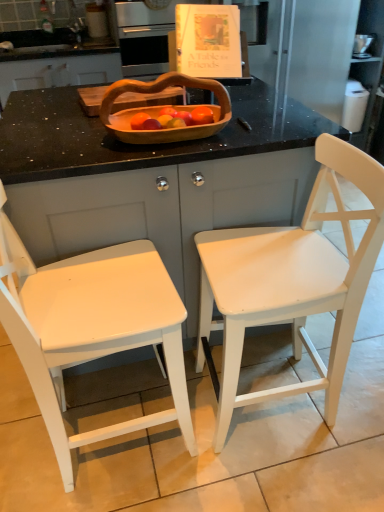
Question: Considering the relative sizes of wooden cutting board at upper center and matte white book at upper center in the image provided, is wooden cutting board at upper center bigger than matte white book at upper center?

Choices:
 (A) no
 (B) yes

Answer: (A)

Question: Can you confirm if wooden cutting board at upper center is wider than matte white book at upper center?

Choices:
 (A) yes
 (B) no

Answer: (B)

Question: Does wooden cutting board at upper center have a smaller size compared to matte white book at upper center?

Choices:
 (A) no
 (B) yes

Answer: (B)

Question: Is wooden cutting board at upper center turned away from matte white book at upper center?

Choices:
 (A) yes
 (B) no

Answer: (A)

Question: From the image's perspective, is wooden cutting board at upper center on matte white book at upper center?

Choices:
 (A) no
 (B) yes

Answer: (A)

Question: Considering the positions of matte wood counter at center and matte white book at upper center in the image, is matte wood counter at center wider or thinner than matte white book at upper center?

Choices:
 (A) wide
 (B) thin

Answer: (A)

Question: Relative to matte white book at upper center, is matte wood counter at center in front or behind?

Choices:
 (A) front
 (B) behind

Answer: (A)

Question: Is point (185, 233) positioned closer to the camera than point (119, 46)?

Choices:
 (A) closer
 (B) farther

Answer: (A)

Question: From a real-world perspective, is matte wood counter at center positioned above or below matte white book at upper center?

Choices:
 (A) below
 (B) above

Answer: (A)

Question: From a real-world perspective, is wooden cutting board at upper center positioned above or below white painted wood chair at left, which is the first chair in left-to-right order?

Choices:
 (A) below
 (B) above

Answer: (B)

Question: In terms of height, does wooden cutting board at upper center look taller or shorter compared to white painted wood chair at left, which is the first chair in left-to-right order?

Choices:
 (A) tall
 (B) short

Answer: (B)

Question: Considering the positions of wooden cutting board at upper center and white painted wood chair at left, which is the first chair in left-to-right order, in the image, is wooden cutting board at upper center bigger or smaller than white painted wood chair at left, which is the first chair in left-to-right order,?

Choices:
 (A) small
 (B) big

Answer: (A)

Question: In terms of width, does wooden cutting board at upper center look wider or thinner when compared to white painted wood chair at left, which is the first chair in left-to-right order?

Choices:
 (A) thin
 (B) wide

Answer: (A)

Question: From a real-world perspective, is matte wood counter at center physically located above or below wooden basket at center?

Choices:
 (A) below
 (B) above

Answer: (A)

Question: From the image's perspective, relative to wooden basket at center, is matte wood counter at center above or below?

Choices:
 (A) above
 (B) below

Answer: (B)